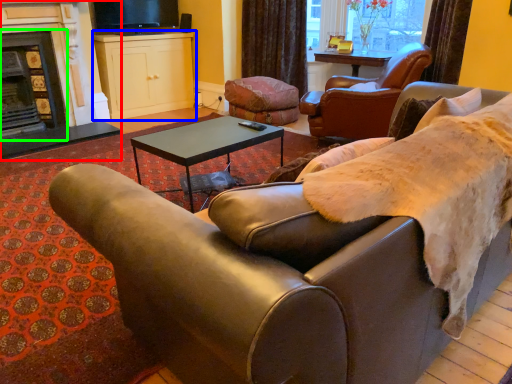
Question: Based on their relative distances, which object is nearer to fireplace (highlighted by a red box)? Choose from cabinetry (highlighted by a blue box) and fireplace (highlighted by a green box).

Choices:
 (A) cabinetry
 (B) fireplace

Answer: (B)